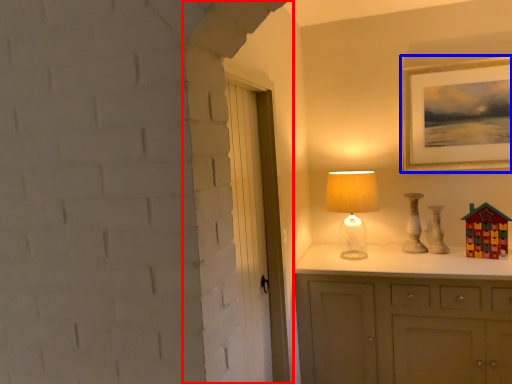
Question: Which object is further to the camera taking this photo, door (highlighted by a red box) or picture frame (highlighted by a blue box)?

Choices:
 (A) door
 (B) picture frame

Answer: (B)